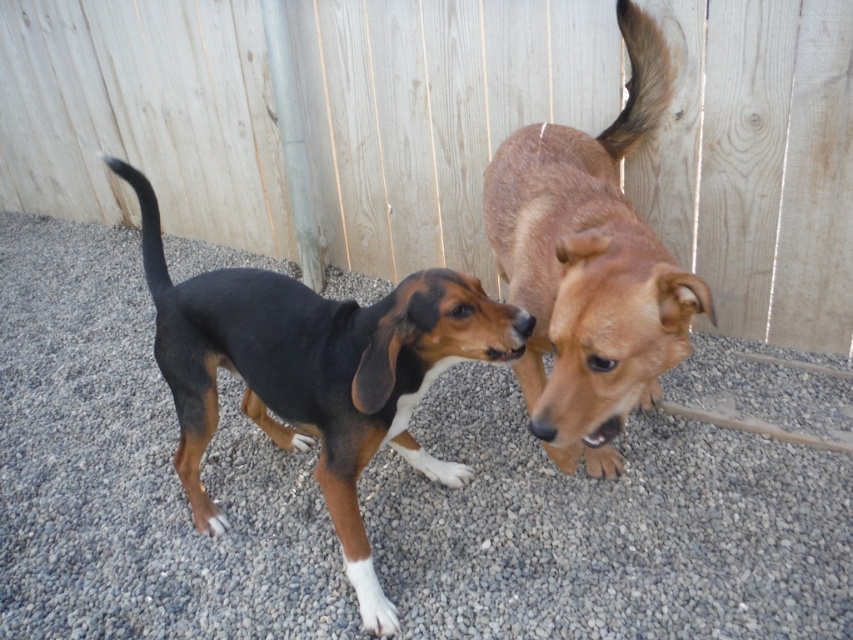
Can you confirm if wooden fence at upper center is bigger than black and brown fur dog at center?

Yes.

Describe the element at coordinates (436, 113) in the screenshot. This screenshot has width=853, height=640. I see `wooden fence at upper center` at that location.

I want to click on wooden fence at upper center, so click(436, 113).

Is wooden fence at upper center closer to camera compared to brown furry dog at upper right?

No, wooden fence at upper center is behind brown furry dog at upper right.

Measure the distance between wooden fence at upper center and camera.

wooden fence at upper center and camera are 5.78 feet apart.

Who is more forward, (x=780, y=180) or (x=538, y=179)?

Point (x=538, y=179)

Identify the location of wooden fence at upper center. (436, 113).

Can you confirm if black and brown fur dog at center is shorter than brown furry dog at upper right?

Indeed, black and brown fur dog at center has a lesser height compared to brown furry dog at upper right.

Who is lower down, black and brown fur dog at center or brown furry dog at upper right?

Positioned lower is black and brown fur dog at center.

Measure the distance between black and brown fur dog at center and camera.

A distance of 4.51 feet exists between black and brown fur dog at center and camera.

You are a GUI agent. You are given a task and a screenshot of the screen. Output one action in this format:
    pyautogui.click(x=<x>, y=<y>)
    Task: Click on the black and brown fur dog at center
    The height and width of the screenshot is (640, 853).
    Given the screenshot: What is the action you would take?
    pyautogui.click(x=316, y=372)